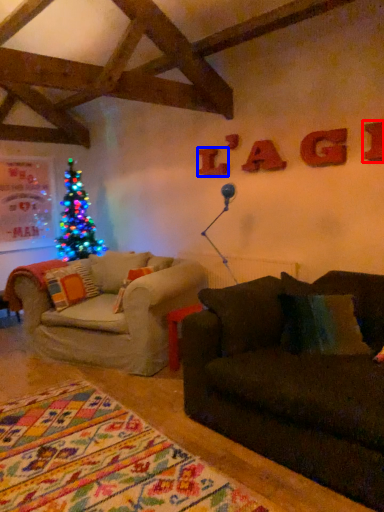
Question: Among these objects, which one is nearest to the camera, letter (highlighted by a red box) or letter (highlighted by a blue box)?

Choices:
 (A) letter
 (B) letter

Answer: (A)